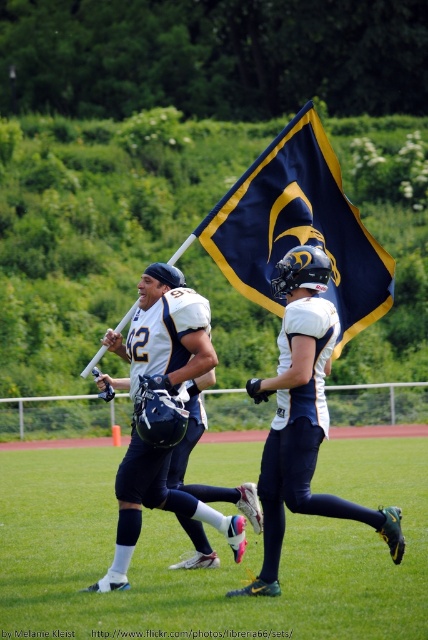
Question: Is the position of navy blue fabric flag at upper center less distant than that of matte white helmet at center?

Choices:
 (A) yes
 (B) no

Answer: (B)

Question: Does green grass football field at center have a smaller size compared to navy blue fabric flag at upper center?

Choices:
 (A) yes
 (B) no

Answer: (B)

Question: Which is nearer to the navy blue fabric flag at upper center?

Choices:
 (A) green grass football field at center
 (B) matte white helmet at center

Answer: (B)

Question: Which of the following is the farthest from the observer?

Choices:
 (A) (98, 608)
 (B) (285, 198)

Answer: (B)

Question: Which of the following is the farthest from the observer?

Choices:
 (A) (199, 236)
 (B) (95, 452)

Answer: (B)

Question: Is navy blue fabric flag at upper center above matte white helmet at center?

Choices:
 (A) yes
 (B) no

Answer: (A)